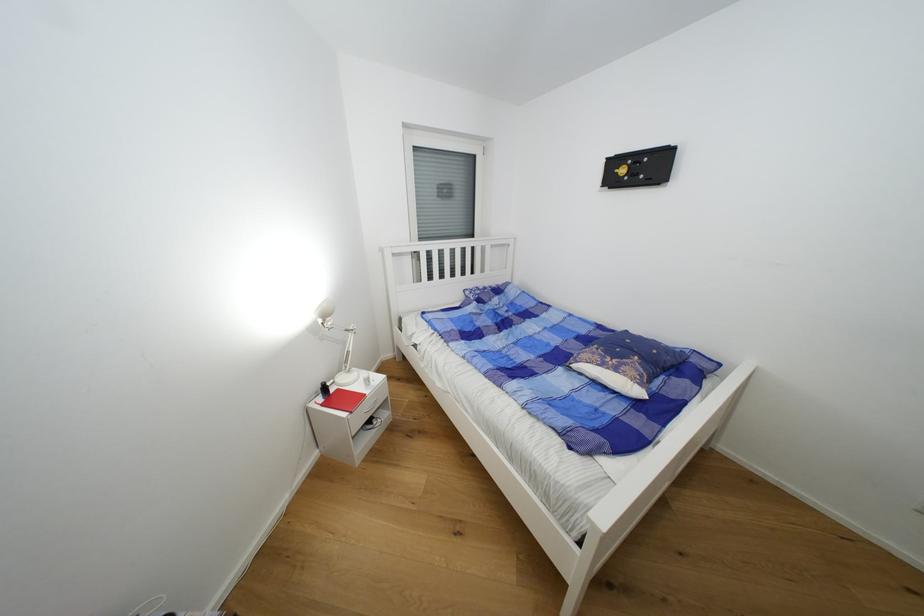
What do you see at coordinates (372, 403) in the screenshot?
I see `the nightstand drawer handle` at bounding box center [372, 403].